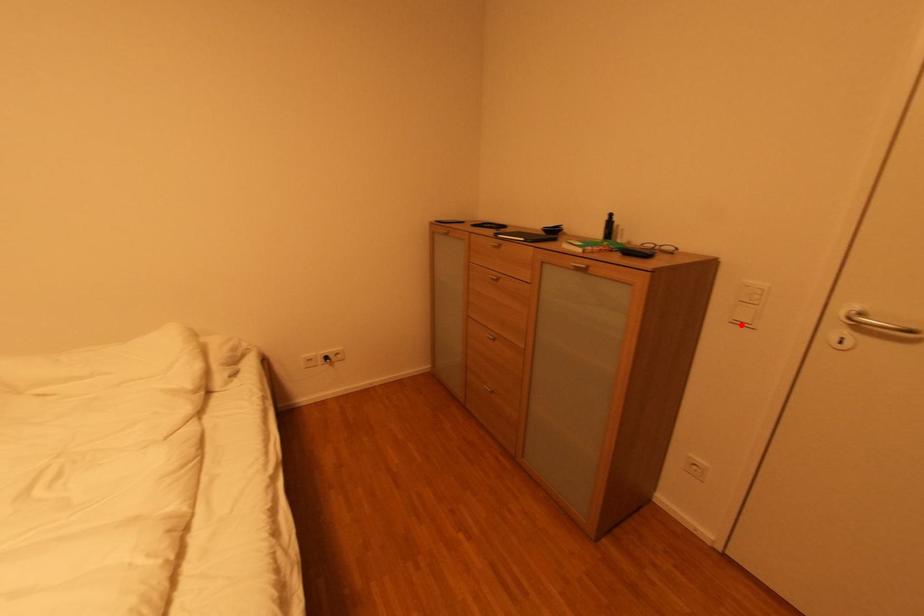
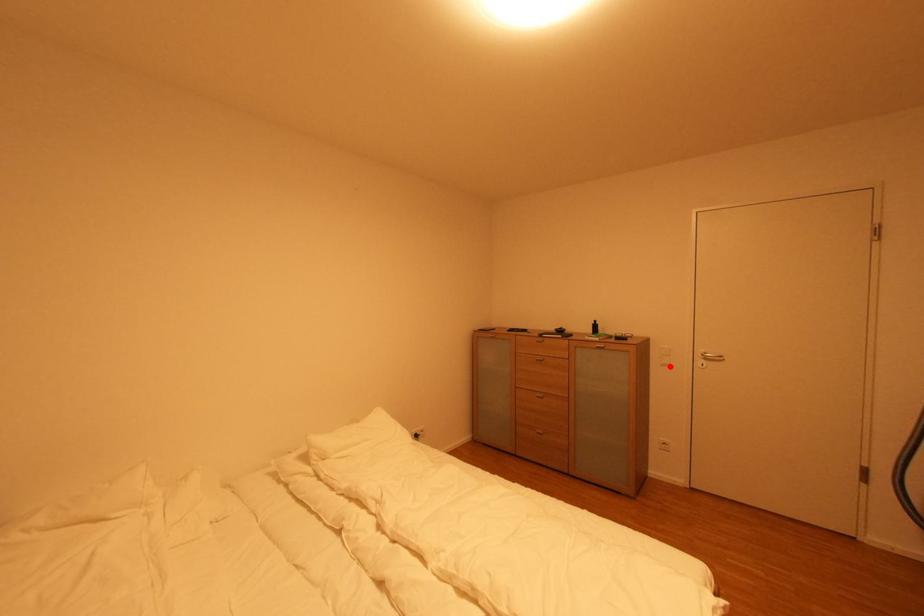
I am providing you with two images of the same scene from different viewpoints. A red point is marked on the first image and another point is marked on the second image. Is the red point in image1 aligned with the point shown in image2?

Yes